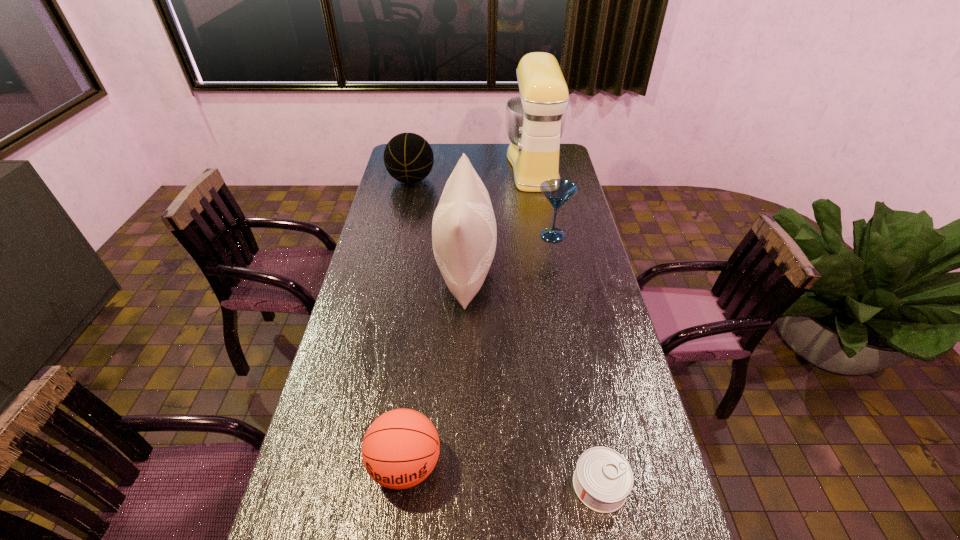
Find the location of a particular element. Image resolution: width=960 pixels, height=540 pixels. object that is at the far right corner is located at coordinates pyautogui.click(x=535, y=120).

Locate an element on the screen. Image resolution: width=960 pixels, height=540 pixels. free location at the far edge of the desktop is located at coordinates (461, 150).

Where is `vacant space at the left edge of the desktop`? This screenshot has height=540, width=960. vacant space at the left edge of the desktop is located at coordinates [394, 235].

Where is `vacant region at the right edge`? This screenshot has height=540, width=960. vacant region at the right edge is located at coordinates (578, 267).

Find the location of a particular element. This screenshot has width=960, height=540. vacant space that is in between the farther basketball and the shorter basketball is located at coordinates (408, 322).

What are the coordinates of `free point between the nearer basketball and the shortest object` in the screenshot? It's located at (503, 475).

You are a GUI agent. You are given a task and a screenshot of the screen. Output one action in this format:
    pyautogui.click(x=<x>, y=<y>)
    Task: Click on the free space between the fifth shortest object and the martini
    The height and width of the screenshot is (540, 960).
    Given the screenshot: What is the action you would take?
    509,253

Where is `vacant point located between the tallest object and the martini`? vacant point located between the tallest object and the martini is located at coordinates (543, 201).

The image size is (960, 540). I want to click on empty space between the shortest object and the taller basketball, so click(506, 333).

Where is `empty location between the cushion and the can`? This screenshot has height=540, width=960. empty location between the cushion and the can is located at coordinates pyautogui.click(x=533, y=378).